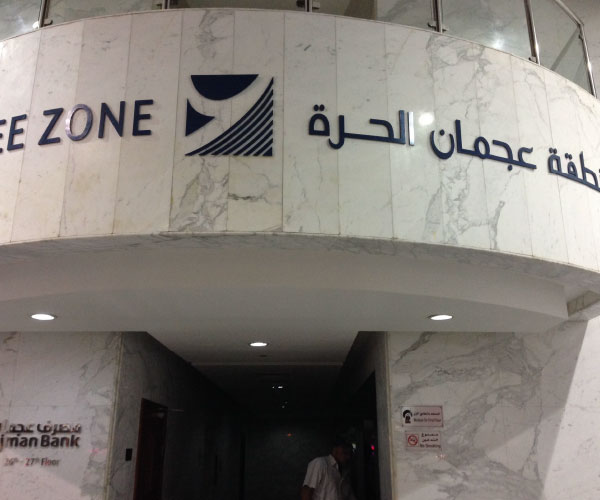
You are a GUI agent. You are given a task and a screenshot of the screen. Output one action in this format:
    pyautogui.click(x=<x>, y=<y>)
    Task: Click on the doorway
    The image size is (600, 500).
    Given the screenshot: What is the action you would take?
    pyautogui.click(x=157, y=441), pyautogui.click(x=367, y=411)